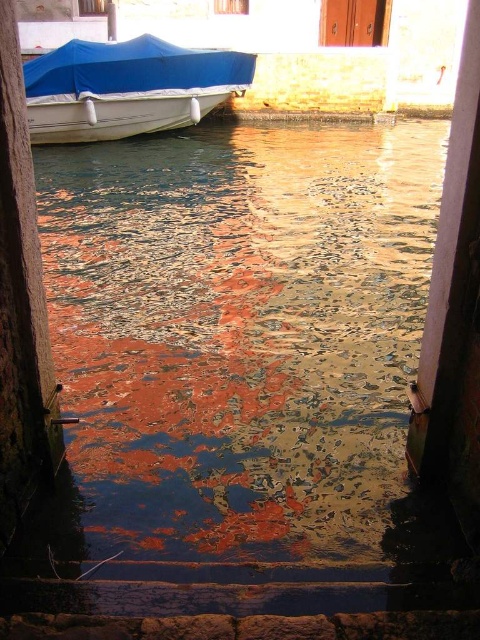
You are a tourist standing on the stone steps leading into the canal. You notice the reflective water at center and the blue tarpaulin boat at upper left. Which object appears bigger in the image?

The reflective water at center appears larger than the blue tarpaulin boat at upper left in the image.